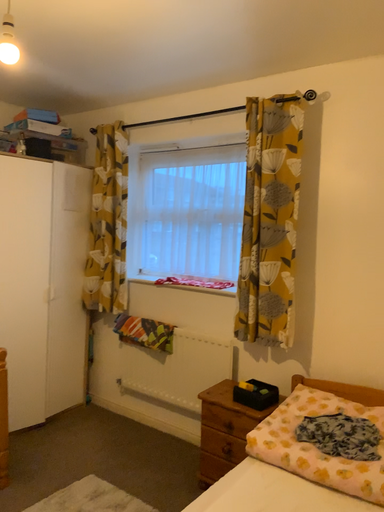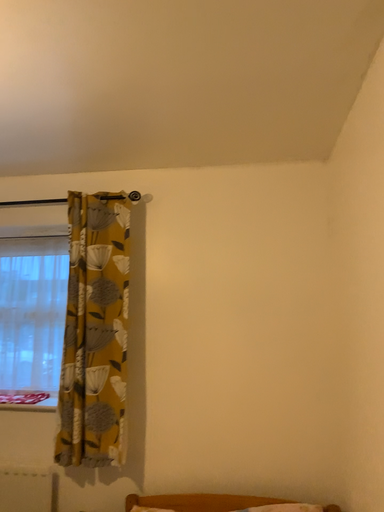
Question: How did the camera likely rotate when shooting the video?

Choices:
 (A) rotated right
 (B) rotated left

Answer: (A)